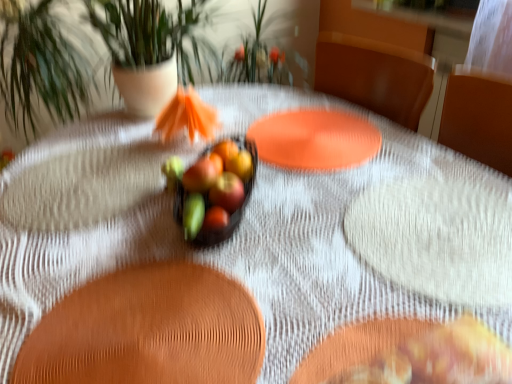
Image resolution: width=512 pixels, height=384 pixels. Identify the location of vacant area that lies in front of glossy apple at center, arranged as the second apple when viewed from the front. (266, 244).